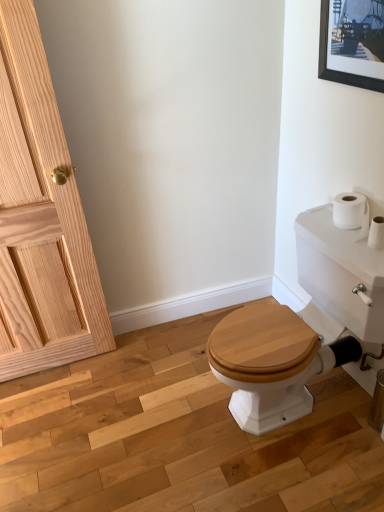
Question: Considering the relative sizes of natural wood door at left and black matte picture frame at upper right in the image provided, is natural wood door at left wider than black matte picture frame at upper right?

Choices:
 (A) no
 (B) yes

Answer: (B)

Question: Are natural wood door at left and black matte picture frame at upper right making contact?

Choices:
 (A) yes
 (B) no

Answer: (B)

Question: Does natural wood door at left contain black matte picture frame at upper right?

Choices:
 (A) no
 (B) yes

Answer: (A)

Question: Is natural wood door at left bigger than black matte picture frame at upper right?

Choices:
 (A) no
 (B) yes

Answer: (B)

Question: Can you confirm if natural wood door at left is smaller than black matte picture frame at upper right?

Choices:
 (A) no
 (B) yes

Answer: (A)

Question: Is natural wood door at left to the left or to the right of white glossy porcelain at right in the image?

Choices:
 (A) left
 (B) right

Answer: (A)

Question: Does point (57, 137) appear closer or farther from the camera than point (279, 406)?

Choices:
 (A) farther
 (B) closer

Answer: (B)

Question: In terms of size, does natural wood door at left appear bigger or smaller than white glossy porcelain at right?

Choices:
 (A) big
 (B) small

Answer: (B)

Question: In terms of height, does natural wood door at left look taller or shorter compared to white glossy porcelain at right?

Choices:
 (A) tall
 (B) short

Answer: (A)

Question: Considering the positions of black matte picture frame at upper right and natural wood door at left in the image, is black matte picture frame at upper right bigger or smaller than natural wood door at left?

Choices:
 (A) big
 (B) small

Answer: (B)

Question: Is black matte picture frame at upper right wider or thinner than natural wood door at left?

Choices:
 (A) thin
 (B) wide

Answer: (A)

Question: Considering the positions of black matte picture frame at upper right and natural wood door at left in the image, is black matte picture frame at upper right taller or shorter than natural wood door at left?

Choices:
 (A) tall
 (B) short

Answer: (B)

Question: From a real-world perspective, is black matte picture frame at upper right positioned above or below natural wood door at left?

Choices:
 (A) above
 (B) below

Answer: (A)

Question: Considering the positions of white glossy porcelain at right and black matte picture frame at upper right in the image, is white glossy porcelain at right taller or shorter than black matte picture frame at upper right?

Choices:
 (A) tall
 (B) short

Answer: (A)

Question: Which is correct: white glossy porcelain at right is inside black matte picture frame at upper right, or outside of it?

Choices:
 (A) outside
 (B) inside

Answer: (A)